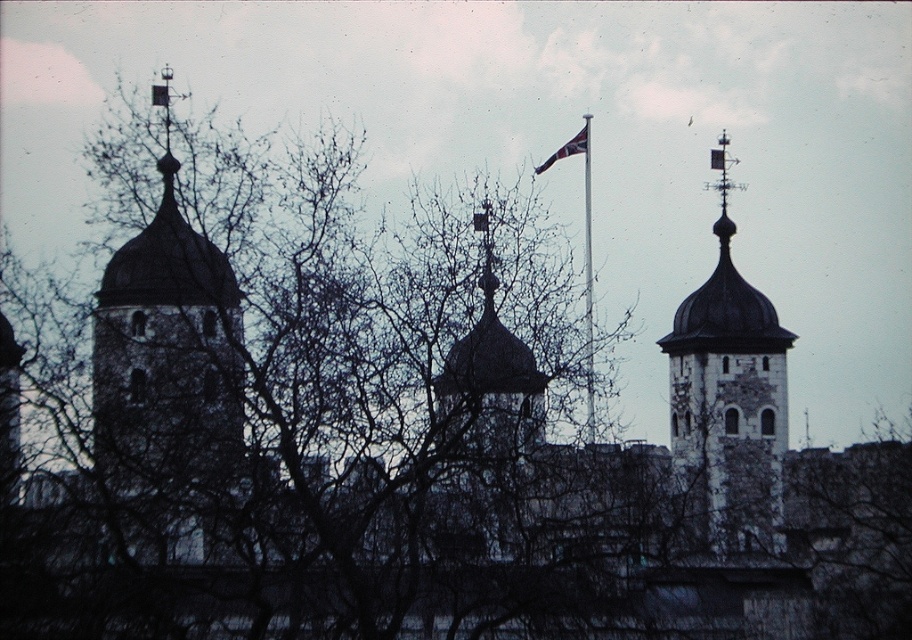
You are a bird flying at a low altitude near the stone dome at upper center and the polished metal flag pole at center. Which structure would you need to fly higher to avoid hitting?

The stone dome at upper center is much taller than the polished metal flag pole at center, so you would need to fly higher to avoid hitting the stone dome at upper center.

You are a tourist standing in front of the three towers. You want to take a photo that includes both the stone dome at upper center and the polished metal flag pole at center. Which object should you focus on first to ensure both are in clear view?

You should focus on the stone dome at upper center first because it is closer to you than the polished metal flag pole at center. By focusing on the closer object, you can ensure both are in clear view.